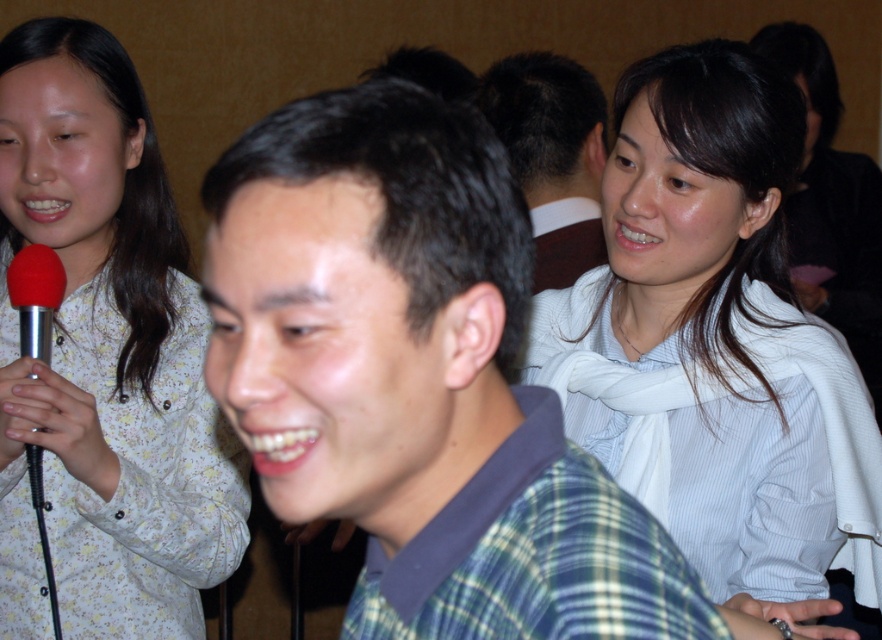
You are organizing a photo shoot and need to ensure that all items are visible in the frame. Given that the green plaid shirt at center and the red rubber microphone at left are both important, which object should be placed closer to the camera to maintain their visibility?

The green plaid shirt at center is taller than the red rubber microphone at left, so to maintain visibility of both, the red rubber microphone at left should be placed closer to the camera since it is shorter and might otherwise be overshadowed by the taller green plaid shirt at center.

You are organizing a conference and need to know the spatial arrangement of the speakers. Are the green plaid shirt at center positioned higher up than the red rubber microphone at left in the image?

The green plaid shirt at center is above the red rubber microphone at left in the image.